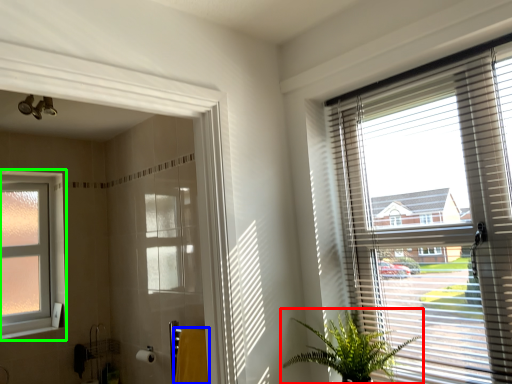
Question: Which object is the closest to the houseplant (highlighted by a red box)? Choose among these: bath towel (highlighted by a blue box) or window (highlighted by a green box).

Choices:
 (A) bath towel
 (B) window

Answer: (A)